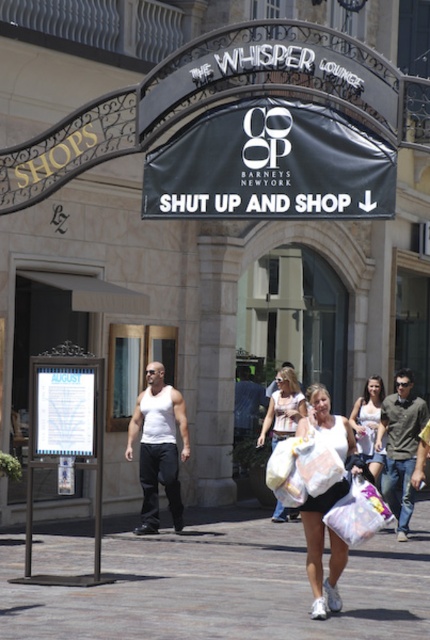
Question: Does gray concrete pavement at lower center have a greater width compared to white matte plastic bag at center?

Choices:
 (A) no
 (B) yes

Answer: (B)

Question: Which point is closer to the camera?

Choices:
 (A) white cotton tank top at center
 (B) gray concrete pavement at lower center

Answer: (B)

Question: Which object is the farthest from the white tank top at center?

Choices:
 (A) white matte plastic bag at center
 (B) denim jeans at center

Answer: (A)

Question: Does gray concrete pavement at lower center appear under white cotton tank top at center?

Choices:
 (A) yes
 (B) no

Answer: (A)

Question: Which of the following is the farthest from the observer?

Choices:
 (A) (272, 406)
 (B) (338, 444)
 (C) (377, 502)

Answer: (A)

Question: Can you confirm if white tank top at center is positioned to the left of denim jeans at center?

Choices:
 (A) yes
 (B) no

Answer: (A)